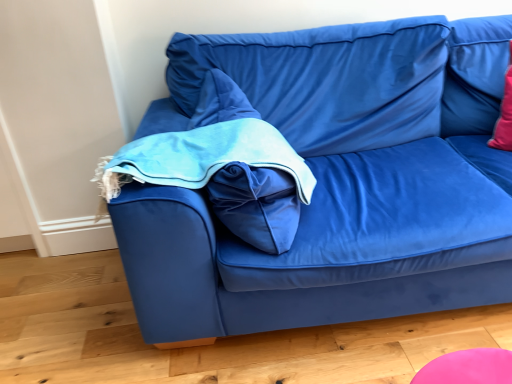
Identify the location of velvet blue bean bag chair at center-left. (224, 166).

The image size is (512, 384). What do you see at coordinates (224, 166) in the screenshot?
I see `velvet blue bean bag chair at center-left` at bounding box center [224, 166].

Measure the distance between velvet blue bean bag chair at center-left and camera.

velvet blue bean bag chair at center-left and camera are 1.11 meters apart.

What do you see at coordinates (336, 181) in the screenshot? I see `velvet blue couch at center` at bounding box center [336, 181].

At what (x,y) coordinates should I click in order to perform the action: click on velvet blue couch at center. Please return your answer as a coordinate pair (x, y). The width and height of the screenshot is (512, 384). Looking at the image, I should click on (336, 181).

Measure the distance between point (179, 213) and camera.

Point (179, 213) is 3.73 feet from camera.

This screenshot has width=512, height=384. Find the location of `velvet blue bean bag chair at center-left`. velvet blue bean bag chair at center-left is located at coordinates (224, 166).

Visually, is velvet blue bean bag chair at center-left positioned to the left or to the right of velvet blue couch at center?

velvet blue bean bag chair at center-left is to the left of velvet blue couch at center.

Is velvet blue bean bag chair at center-left further to camera compared to velvet blue couch at center?

Yes, it is.

Does point (228, 90) appear closer or farther from the camera than point (134, 219)?

Clearly, point (228, 90) is more distant from the camera than point (134, 219).

From the image's perspective, does velvet blue bean bag chair at center-left appear lower than velvet blue couch at center?

Yes.

From a real-world perspective, is velvet blue bean bag chair at center-left located beneath velvet blue couch at center?

No, from a real-world perspective, velvet blue bean bag chair at center-left is not beneath velvet blue couch at center.

Which object is wider, velvet blue bean bag chair at center-left or velvet blue couch at center?

velvet blue couch at center.

Considering the sizes of objects velvet blue bean bag chair at center-left and velvet blue couch at center in the image provided, who is shorter, velvet blue bean bag chair at center-left or velvet blue couch at center?

velvet blue bean bag chair at center-left.

Who is bigger, velvet blue bean bag chair at center-left or velvet blue couch at center?

velvet blue couch at center.

Would you say velvet blue bean bag chair at center-left is inside or outside velvet blue couch at center?

velvet blue bean bag chair at center-left can be found inside velvet blue couch at center.

Can you see velvet blue bean bag chair at center-left touching velvet blue couch at center?

There is a gap between velvet blue bean bag chair at center-left and velvet blue couch at center.

Is velvet blue bean bag chair at center-left facing away from velvet blue couch at center?

Yes, velvet blue bean bag chair at center-left's orientation is away from velvet blue couch at center.

How distant is velvet blue bean bag chair at center-left from velvet blue couch at center?

They are 10.26 inches apart.

Locate an element on the screen. studio couch below the velvet blue bean bag chair at center-left (from a real-world perspective) is located at coordinates pyautogui.click(x=336, y=181).

Can you confirm if velvet blue couch at center is positioned to the left of velvet blue bean bag chair at center-left?

No, velvet blue couch at center is not to the left of velvet blue bean bag chair at center-left.

From the picture: Is velvet blue couch at center positioned before velvet blue bean bag chair at center-left?

That is True.

Which is closer to the camera, (334,252) or (102,189)?

Point (334,252).

From the image's perspective, between velvet blue couch at center and velvet blue bean bag chair at center-left, which one is located above?

velvet blue couch at center is shown above in the image.

From a real-world perspective, is velvet blue couch at center positioned under velvet blue bean bag chair at center-left based on gravity?

Correct, in the physical world, velvet blue couch at center is lower than velvet blue bean bag chair at center-left.

Is velvet blue couch at center thinner than velvet blue bean bag chair at center-left?

No.

Who is shorter, velvet blue couch at center or velvet blue bean bag chair at center-left?

With less height is velvet blue bean bag chair at center-left.

Who is bigger, velvet blue couch at center or velvet blue bean bag chair at center-left?

With larger size is velvet blue couch at center.

Is velvet blue bean bag chair at center-left surrounded by velvet blue couch at center?

Indeed, velvet blue bean bag chair at center-left is located within velvet blue couch at center.

Is velvet blue couch at center not near velvet blue bean bag chair at center-left?

Actually, velvet blue couch at center and velvet blue bean bag chair at center-left are a little close together.

Is velvet blue couch at center aimed at velvet blue bean bag chair at center-left?

Yes, velvet blue couch at center is facing velvet blue bean bag chair at center-left.

Measure the distance between velvet blue couch at center and velvet blue bean bag chair at center-left.

velvet blue couch at center is 10.26 inches from velvet blue bean bag chair at center-left.

You are a GUI agent. You are given a task and a screenshot of the screen. Output one action in this format:
    pyautogui.click(x=<x>, y=<y>)
    Task: Click on the studio couch located in front of the velvet blue bean bag chair at center-left
    
    Given the screenshot: What is the action you would take?
    pyautogui.click(x=336, y=181)

The height and width of the screenshot is (384, 512). What are the coordinates of `studio couch that appears on the right of velvet blue bean bag chair at center-left` in the screenshot? It's located at (336, 181).

Locate an element on the screen. This screenshot has width=512, height=384. bean bag chair that appears on the left of velvet blue couch at center is located at coordinates (224, 166).